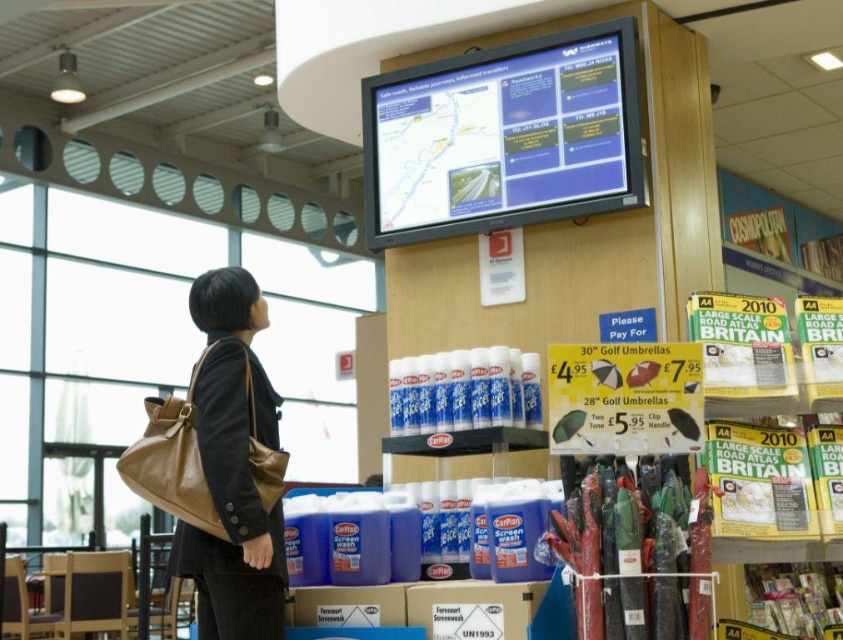
Question: Is brown leather bag at lower left smaller than brown leather bag at left?

Choices:
 (A) yes
 (B) no

Answer: (B)

Question: Observing the image, what is the correct spatial positioning of brown leather bag at lower left in reference to brown leather bag at left?

Choices:
 (A) above
 (B) below

Answer: (A)

Question: Which of the following is the closest to the observer?

Choices:
 (A) brown leather bag at left
 (B) brown leather bag at lower left

Answer: (B)

Question: In this image, where is brown leather bag at lower left located relative to brown leather bag at left?

Choices:
 (A) left
 (B) right

Answer: (B)